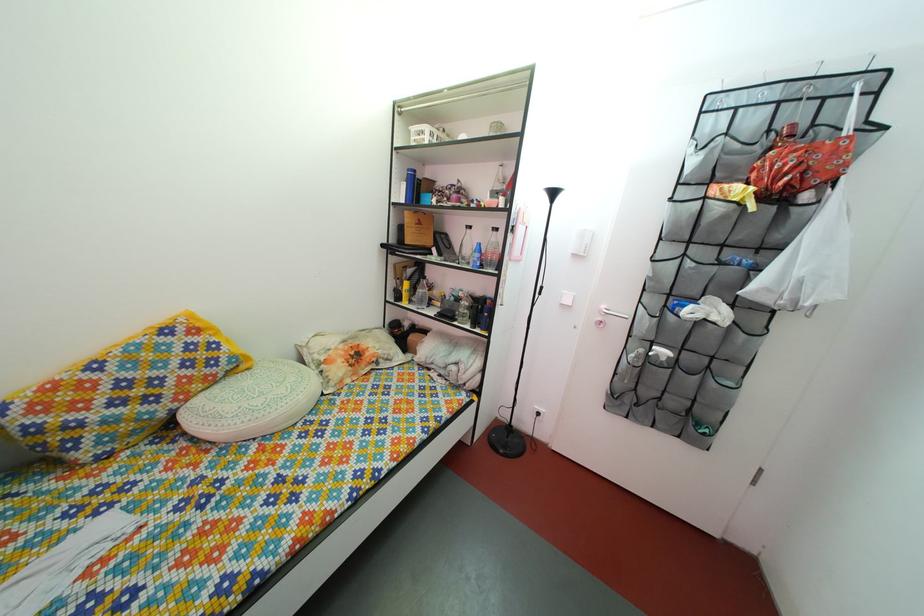
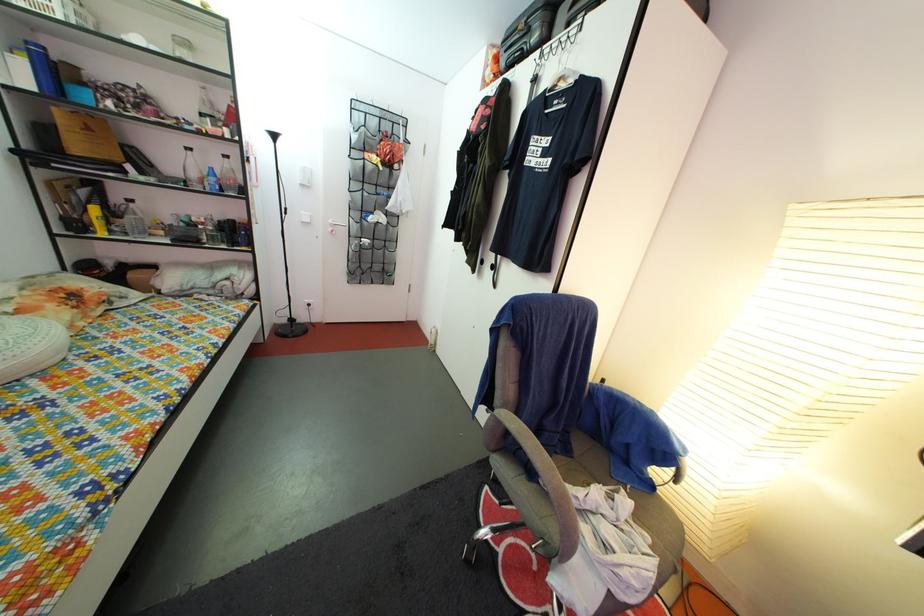
The point at (489, 260) is marked in the first image. Where is the corresponding point in the second image?

(225, 185)